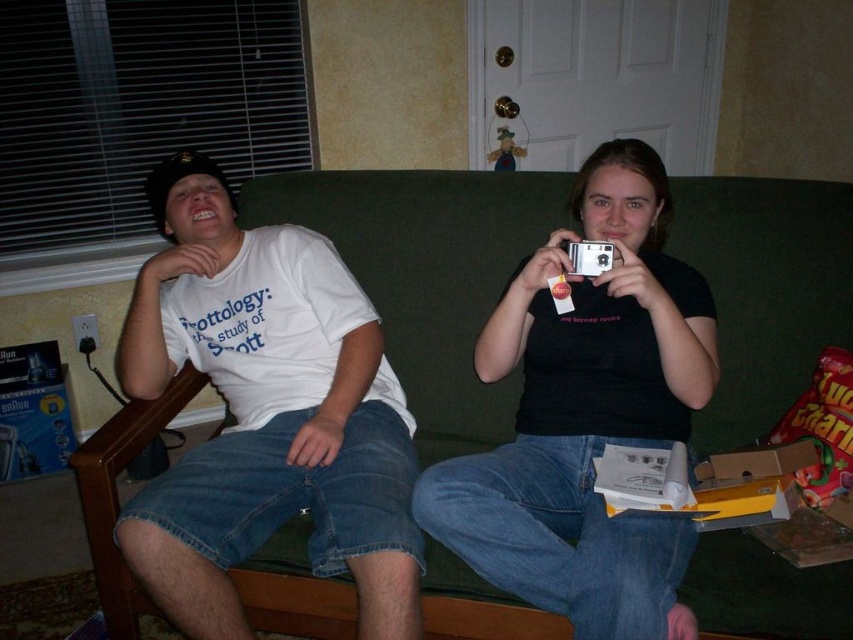
You are standing at the entrance of the room and want to sit on the green fabric couch at center. Which direction should you walk to reach it?

The green fabric couch at center is located at point 0.430 on the x axis and 0.502 on the y axis, so you should walk towards the center of the room to reach it.